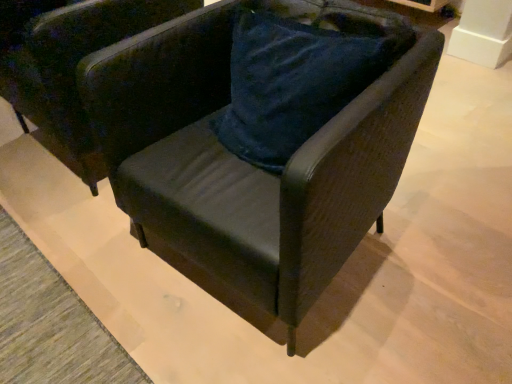
You are a GUI agent. You are given a task and a screenshot of the screen. Output one action in this format:
    pyautogui.click(x=<x>, y=<y>)
    Task: Click on the free space to the left of velvet dark green armchair at center, the 2th chair viewed from the left
    Image resolution: width=512 pixels, height=384 pixels.
    Given the screenshot: What is the action you would take?
    pyautogui.click(x=99, y=257)